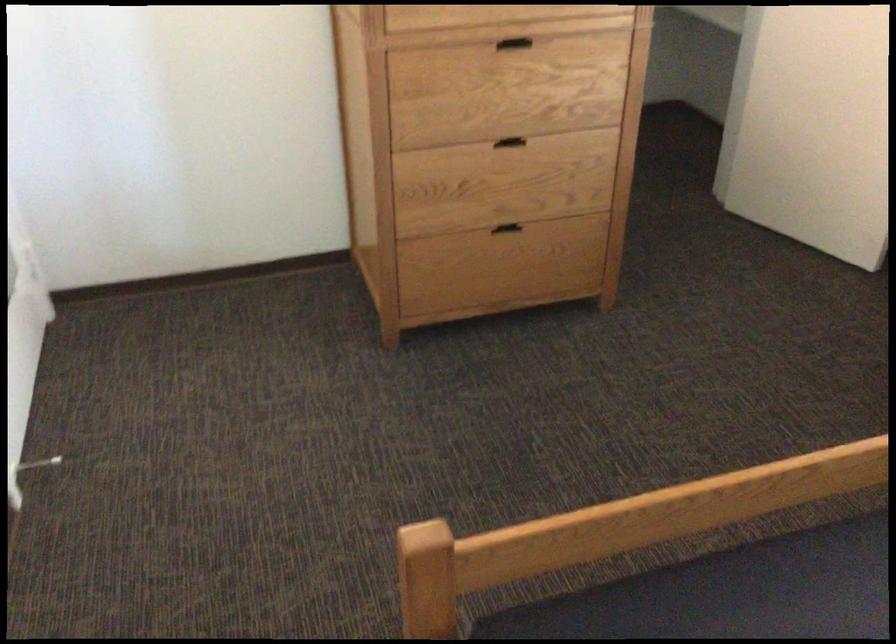
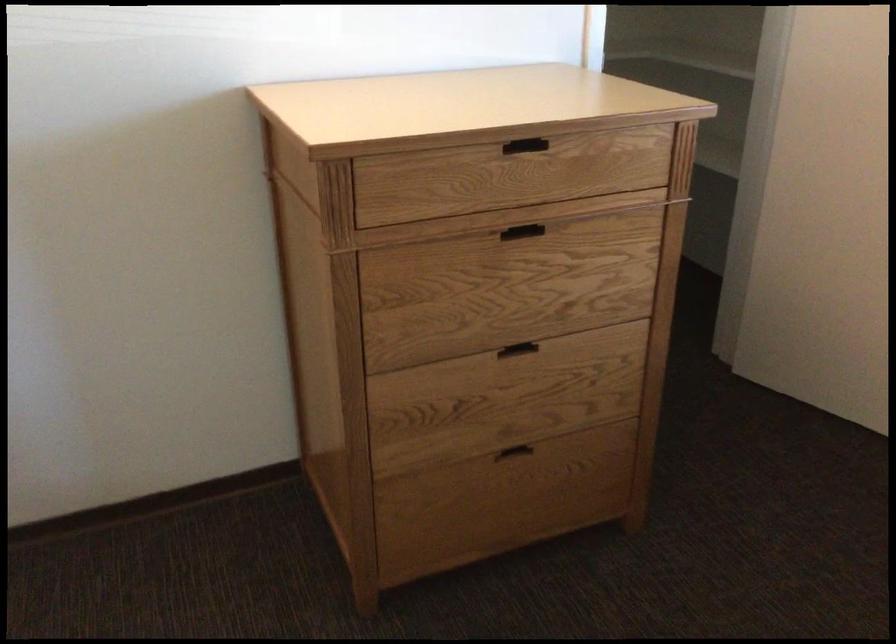
Question: Which direction would the cameraman need to move to produce the second image? Reply with the corresponding letter.

Choices:
 (A) Left
 (B) Right
 (C) Forward
 (D) Backward

Answer: (C)